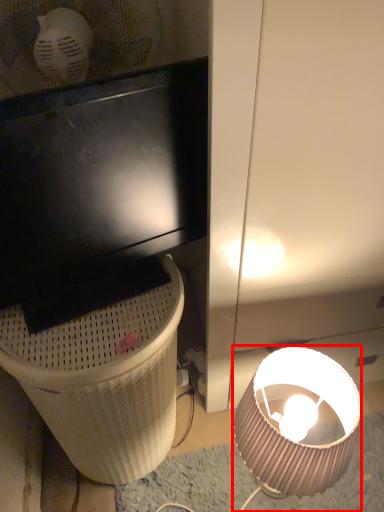
Question: In this image, where is lamp (annotated by the red box) located relative to trash bin/can?

Choices:
 (A) left
 (B) right

Answer: (B)